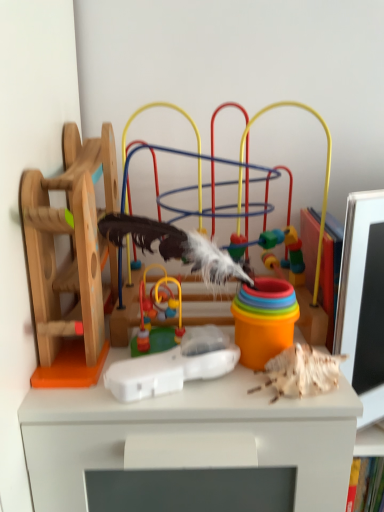
Image resolution: width=384 pixels, height=512 pixels. What do you see at coordinates (159, 315) in the screenshot? I see `smooth plastic toy at center, placed as the second toy when sorted from left to right` at bounding box center [159, 315].

Measure the distance between multicolored plastic toy at center, the 1th toy positioned from the right, and camera.

A distance of 18.49 inches exists between multicolored plastic toy at center, the 1th toy positioned from the right, and camera.

Measure the distance between point (91, 336) and camera.

Point (91, 336) and camera are 21.02 inches apart.

In order to face white plastic remote at center, arranged as the second toy when viewed from the right, should I rotate leftwards or rightwards?

It's best to rotate left around 2.443 degrees.

Locate an element on the screen. This screenshot has height=512, width=384. smooth plastic toy at center, placed as the second toy when sorted from left to right is located at coordinates (159, 315).

Is multicolored plastic toy at center, the 1th toy positioned from the right, closer to the viewer compared to white plastic remote at center, the 3th toy viewed from the left?

That is False.

Is point (51, 331) behind point (136, 392)?

Yes.

Based on the photo, how distant is multicolored plastic toy at center, the 1th toy positioned from the right, from white plastic remote at center, arranged as the second toy when viewed from the right?

The distance of multicolored plastic toy at center, the 1th toy positioned from the right, from white plastic remote at center, arranged as the second toy when viewed from the right, is 7.66 inches.

Is multicolored plastic toy at center, which appears as the fourth toy when viewed from the left, outside of white plastic remote at center, the 3th toy viewed from the left?

multicolored plastic toy at center, which appears as the fourth toy when viewed from the left, is positioned outside white plastic remote at center, the 3th toy viewed from the left.

Is wooden toy at left, marked as the 1th toy in a left-to-right arrangement, in front of or behind smooth plastic toy at center, placed as the second toy when sorted from left to right, in the image?

In the image, wooden toy at left, marked as the 1th toy in a left-to-right arrangement, appears in front of smooth plastic toy at center, placed as the second toy when sorted from left to right.

Is wooden toy at left, acting as the 4th toy starting from the right, not within smooth plastic toy at center, placed as the second toy when sorted from left to right?

Yes.

Does wooden toy at left, acting as the 4th toy starting from the right, turn towards smooth plastic toy at center, placed as the second toy when sorted from left to right?

No, wooden toy at left, acting as the 4th toy starting from the right, is not turned towards smooth plastic toy at center, placed as the second toy when sorted from left to right.

From the image's perspective, between white plastic remote at center, arranged as the second toy when viewed from the right, and multicolored plastic toy at center, which appears as the fourth toy when viewed from the left, who is located below?

white plastic remote at center, arranged as the second toy when viewed from the right, appears lower in the image.

Is the depth of white plastic remote at center, the 3th toy viewed from the left, greater than that of multicolored plastic toy at center, which appears as the fourth toy when viewed from the left?

That is False.

How many degrees apart are the facing directions of white plastic remote at center, arranged as the second toy when viewed from the right, and multicolored plastic toy at center, which appears as the fourth toy when viewed from the left?

The angular difference between white plastic remote at center, arranged as the second toy when viewed from the right, and multicolored plastic toy at center, which appears as the fourth toy when viewed from the left, is 17.5 degrees.

Looking at their sizes, would you say white plastic remote at center, the 3th toy viewed from the left, is wider or thinner than multicolored plastic toy at center, the 1th toy positioned from the right?

In the image, white plastic remote at center, the 3th toy viewed from the left, appears to be more narrow than multicolored plastic toy at center, the 1th toy positioned from the right.

Is point (144, 280) in front of point (90, 142)?

No.

Is smooth plastic toy at center, placed as the second toy when sorted from left to right, far from wooden toy at left, acting as the 4th toy starting from the right?

No, there isn't a large distance between smooth plastic toy at center, placed as the second toy when sorted from left to right, and wooden toy at left, acting as the 4th toy starting from the right.

Considering the relative sizes of smooth plastic toy at center, placed as the second toy when sorted from left to right, and wooden toy at left, acting as the 4th toy starting from the right, in the image provided, is smooth plastic toy at center, placed as the second toy when sorted from left to right, shorter than wooden toy at left, acting as the 4th toy starting from the right,?

Indeed, smooth plastic toy at center, placed as the second toy when sorted from left to right, has a lesser height compared to wooden toy at left, acting as the 4th toy starting from the right.

How distant is smooth plastic toy at center, placed as the 3th toy when sorted from right to left, from wooden toy at left, acting as the 4th toy starting from the right?

A distance of 5.40 inches exists between smooth plastic toy at center, placed as the 3th toy when sorted from right to left, and wooden toy at left, acting as the 4th toy starting from the right.

Considering the points (225, 368) and (157, 281), which point is behind, point (225, 368) or point (157, 281)?

The point (157, 281) is behind.

Which toy is the 1st one when counting from the right side of the smooth plastic toy at center, placed as the second toy when sorted from left to right? Please provide its 2D coordinates.

[(165, 372)]

Does white plastic remote at center, arranged as the second toy when viewed from the right, contain smooth plastic toy at center, placed as the 3th toy when sorted from right to left?

No, white plastic remote at center, arranged as the second toy when viewed from the right, does not contain smooth plastic toy at center, placed as the 3th toy when sorted from right to left.

Is white plastic remote at center, the 3th toy viewed from the left, to the left of smooth plastic toy at center, placed as the 3th toy when sorted from right to left, from the viewer's perspective?

No.

How different are the orientations of white plastic remote at center, arranged as the second toy when viewed from the right, and wooden toy at left, acting as the 4th toy starting from the right, in degrees?

17.5 degrees separate the facing orientations of white plastic remote at center, arranged as the second toy when viewed from the right, and wooden toy at left, acting as the 4th toy starting from the right.

From a real-world perspective, which is physically above, white plastic remote at center, arranged as the second toy when viewed from the right, or wooden toy at left, acting as the 4th toy starting from the right?

From a 3D spatial view, wooden toy at left, acting as the 4th toy starting from the right, is above.

Locate an element on the screen. This screenshot has height=512, width=384. toy that is the 1st one when counting backward from the wooden toy at left, marked as the 1th toy in a left-to-right arrangement is located at coordinates (165, 372).

From the image's perspective, which is above, white plastic remote at center, the 3th toy viewed from the left, or wooden toy at left, acting as the 4th toy starting from the right?

wooden toy at left, acting as the 4th toy starting from the right.

From a real-world perspective, relative to smooth plastic toy at center, placed as the 3th toy when sorted from right to left, is multicolored plastic toy at center, which appears as the fourth toy when viewed from the left, vertically above or below?

multicolored plastic toy at center, which appears as the fourth toy when viewed from the left, is situated higher than smooth plastic toy at center, placed as the 3th toy when sorted from right to left, in the real world.

Between multicolored plastic toy at center, the 1th toy positioned from the right, and smooth plastic toy at center, placed as the second toy when sorted from left to right, which one has larger size?

multicolored plastic toy at center, the 1th toy positioned from the right.

Find the location of a particular element. the 2nd toy counting from the left of the multicolored plastic toy at center, the 1th toy positioned from the right is located at coordinates (159, 315).

From the picture: Is multicolored plastic toy at center, the 1th toy positioned from the right, wider than smooth plastic toy at center, placed as the 3th toy when sorted from right to left?

Correct, the width of multicolored plastic toy at center, the 1th toy positioned from the right, exceeds that of smooth plastic toy at center, placed as the 3th toy when sorted from right to left.

There is a white plastic remote at center, the 3th toy viewed from the left. In order to click on the 3rd toy above it (from the image's perspective) in this screenshot , I will do `click(72, 259)`.

Identify the location of toy located on the left of smooth plastic toy at center, placed as the second toy when sorted from left to right. coord(71,260).

When comparing their distances from wooden toy at left, marked as the 1th toy in a left-to-right arrangement, does smooth plastic toy at center, placed as the 3th toy when sorted from right to left, or white plastic remote at center, arranged as the second toy when viewed from the right, seem further?

white plastic remote at center, arranged as the second toy when viewed from the right, lies further to wooden toy at left, marked as the 1th toy in a left-to-right arrangement, than the other object.

Which object lies further to the anchor point white plastic remote at center, the 3th toy viewed from the left, wooden toy at left, marked as the 1th toy in a left-to-right arrangement, or smooth plastic toy at center, placed as the 3th toy when sorted from right to left?

wooden toy at left, marked as the 1th toy in a left-to-right arrangement, is positioned further to the anchor white plastic remote at center, the 3th toy viewed from the left.

From the image, which object appears to be farther from multicolored plastic toy at center, the 1th toy positioned from the right, white plastic remote at center, arranged as the second toy when viewed from the right, or wooden toy at left, acting as the 4th toy starting from the right?

white plastic remote at center, arranged as the second toy when viewed from the right, is further to multicolored plastic toy at center, the 1th toy positioned from the right.

Looking at the image, which one is located closer to wooden toy at left, acting as the 4th toy starting from the right, white plastic remote at center, the 3th toy viewed from the left, or multicolored plastic toy at center, the 1th toy positioned from the right?

multicolored plastic toy at center, the 1th toy positioned from the right, lies closer to wooden toy at left, acting as the 4th toy starting from the right, than the other object.

When comparing their distances from multicolored plastic toy at center, the 1th toy positioned from the right, does smooth plastic toy at center, placed as the second toy when sorted from left to right, or white plastic remote at center, the 3th toy viewed from the left, seem closer?

The object closer to multicolored plastic toy at center, the 1th toy positioned from the right, is smooth plastic toy at center, placed as the second toy when sorted from left to right.

Considering their positions, is multicolored plastic toy at center, which appears as the fourth toy when viewed from the left, positioned closer to smooth plastic toy at center, placed as the 3th toy when sorted from right to left, than white plastic remote at center, arranged as the second toy when viewed from the right?

The object closer to smooth plastic toy at center, placed as the 3th toy when sorted from right to left, is white plastic remote at center, arranged as the second toy when viewed from the right.

Looking at the image, which one is located further to wooden toy at left, marked as the 1th toy in a left-to-right arrangement, multicolored plastic toy at center, which appears as the fourth toy when viewed from the left, or white plastic remote at center, the 3th toy viewed from the left?

Among the two, white plastic remote at center, the 3th toy viewed from the left, is located further to wooden toy at left, marked as the 1th toy in a left-to-right arrangement.

Looking at the image, which one is located further to multicolored plastic toy at center, which appears as the fourth toy when viewed from the left, wooden toy at left, marked as the 1th toy in a left-to-right arrangement, or smooth plastic toy at center, placed as the 3th toy when sorted from right to left?

smooth plastic toy at center, placed as the 3th toy when sorted from right to left, is positioned further to the anchor multicolored plastic toy at center, which appears as the fourth toy when viewed from the left.

In order to click on toy that lies between wooden toy at left, acting as the 4th toy starting from the right, and white plastic remote at center, arranged as the second toy when viewed from the right, from top to bottom in this screenshot , I will do `click(159, 315)`.